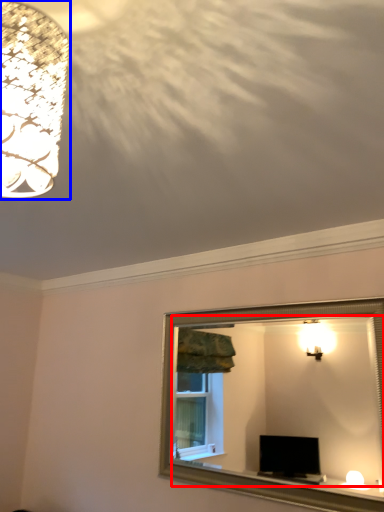
Question: Which point is closer to the camera, mirror (highlighted by a red box) or lamp (highlighted by a blue box)?

Choices:
 (A) mirror
 (B) lamp

Answer: (B)